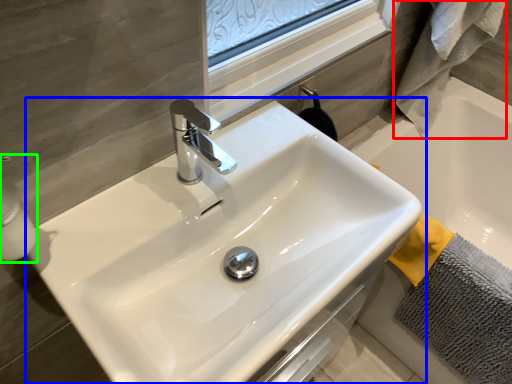
Question: Based on their relative distances, which object is farther from bath towel (highlighted by a red box)? Choose from sink (highlighted by a blue box) and soap dispenser (highlighted by a green box).

Choices:
 (A) sink
 (B) soap dispenser

Answer: (B)